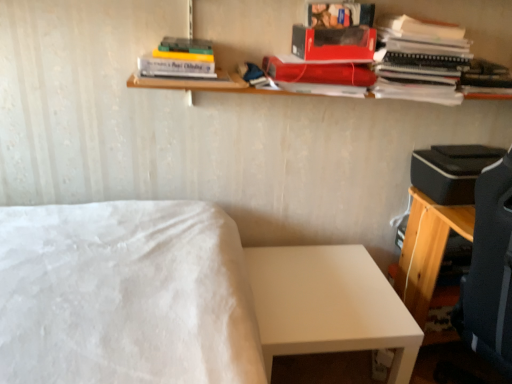
Find the location of `empty space that is ontop of white matte table at lower right (from a real-world perspective)`. empty space that is ontop of white matte table at lower right (from a real-world perspective) is located at coordinates (320, 285).